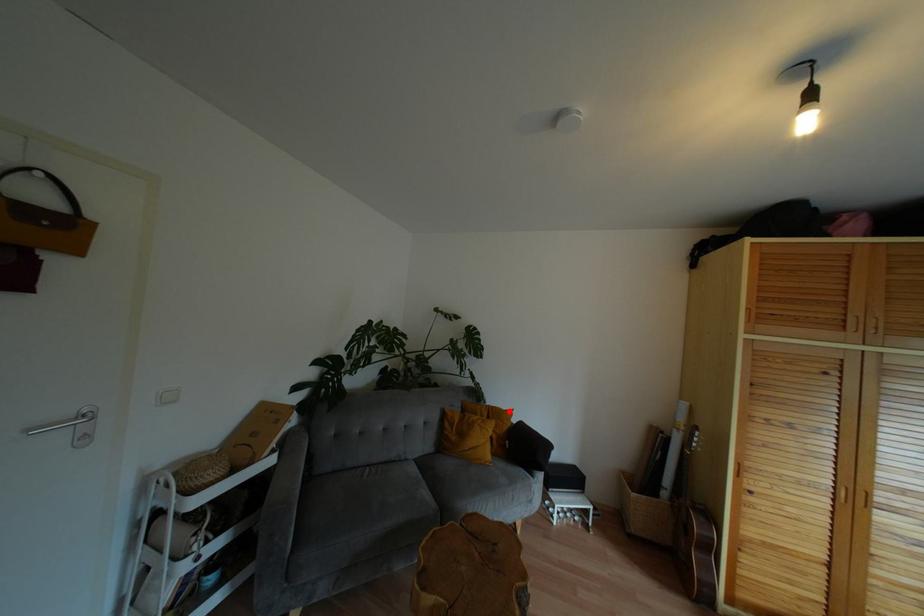
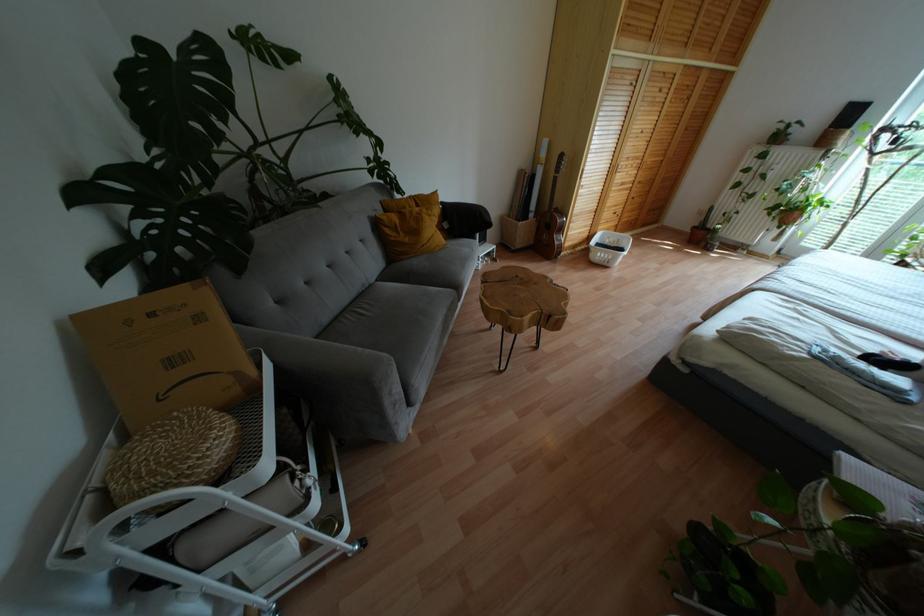
Question: I am providing you with two images of the same scene from different viewpoints. A red point is shown in image1. For the corresponding object point in image2, is it positioned nearer or farther from the camera?

Choices:
 (A) Nearer
 (B) Farther

Answer: (A)